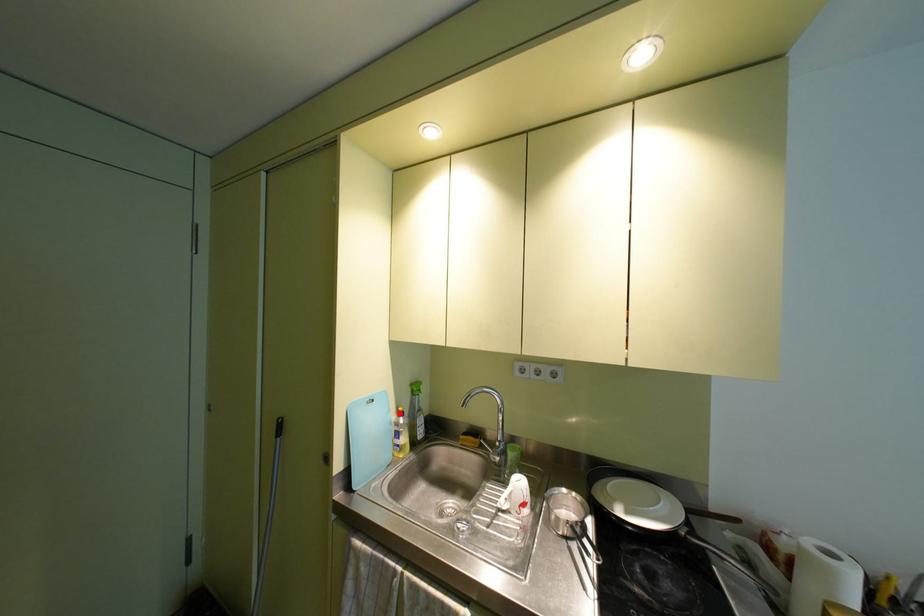
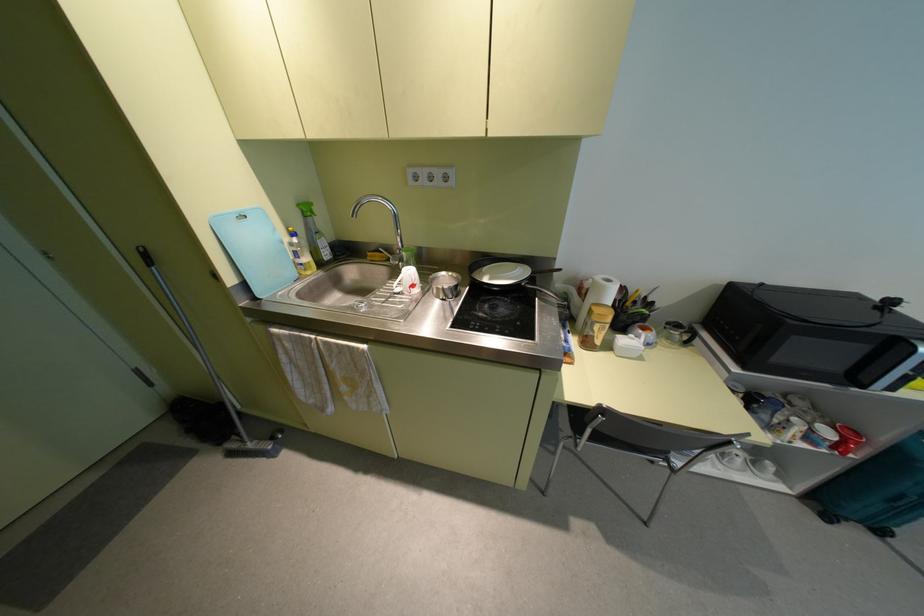
Question: I am providing you with two images of the same scene from different viewpoints. A red point is shown in image1. For the corresponding object point in image2, is it positioned nearer or farther from the camera?

Choices:
 (A) Nearer
 (B) Farther

Answer: (A)